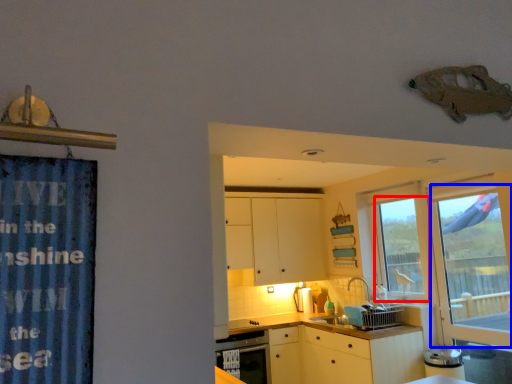
Question: Which of the following is the farthest to the observer, window (highlighted by a red box) or glass door (highlighted by a blue box)?

Choices:
 (A) window
 (B) glass door

Answer: (A)